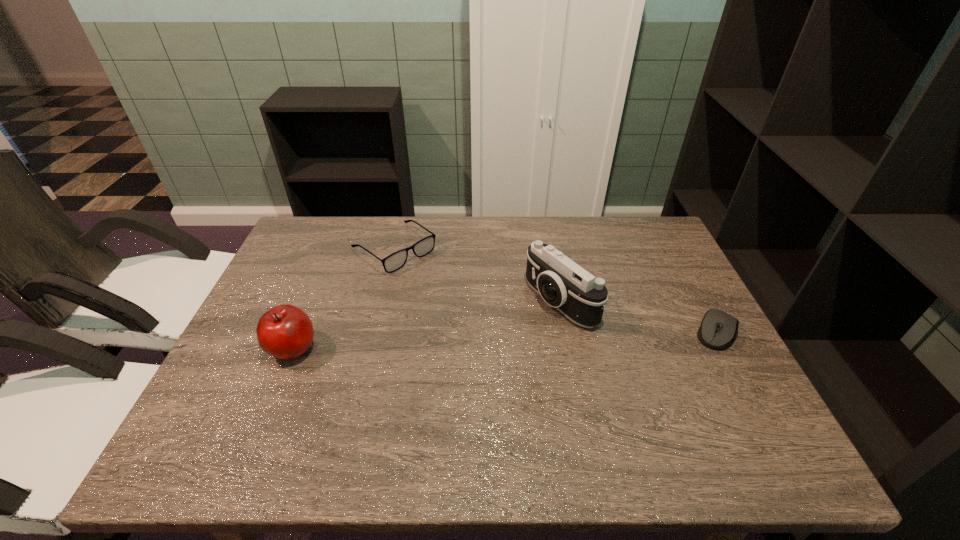
Locate an element on the screen. apple is located at coordinates (286, 332).

This screenshot has width=960, height=540. Find the location of `computer equipment`. computer equipment is located at coordinates (718, 330).

Find the location of `the shortest object`. the shortest object is located at coordinates (718, 330).

You are a GUI agent. You are given a task and a screenshot of the screen. Output one action in this format:
    pyautogui.click(x=<x>, y=<y>)
    Task: Click on the third object from left to right
    The image size is (960, 540).
    Given the screenshot: What is the action you would take?
    pyautogui.click(x=563, y=284)

The height and width of the screenshot is (540, 960). What are the coordinates of `spectacles` in the screenshot? It's located at (395, 261).

Where is `vacant space situated on the left of the second tallest object`? This screenshot has width=960, height=540. vacant space situated on the left of the second tallest object is located at coordinates (234, 348).

Identify the location of free space located 0.310m on the left of the computer equipment. The width and height of the screenshot is (960, 540). (570, 332).

Image resolution: width=960 pixels, height=540 pixels. I want to click on free region located 0.340m on the front lens of the camera, so click(x=421, y=383).

At what (x,y) coordinates should I click in order to perform the action: click on vacant space located on the front lens of the camera. Please return your answer as a coordinate pair (x, y). The height and width of the screenshot is (540, 960). Looking at the image, I should click on (441, 373).

The height and width of the screenshot is (540, 960). Identify the location of vacant space situated on the front lens of the camera. (476, 353).